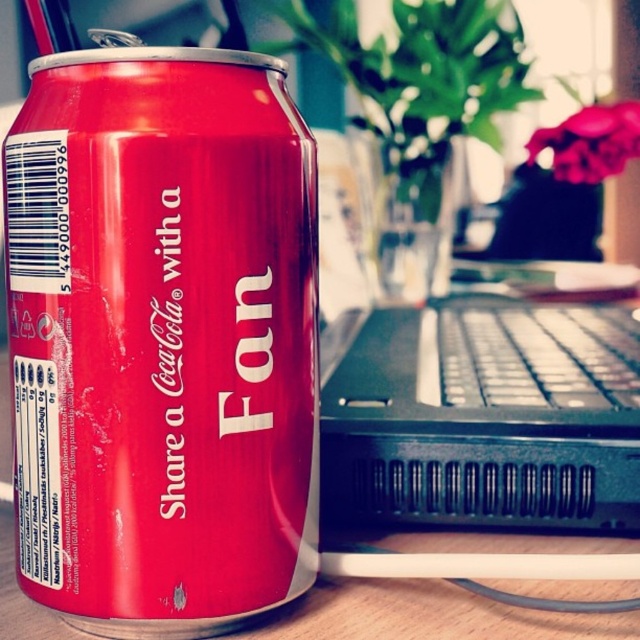
Looking at this image, measure the distance between matte red can at center and black plastic keyboard at center.

A distance of 14.00 inches exists between matte red can at center and black plastic keyboard at center.

Is matte red can at center positioned in front of black plastic keyboard at center?

Yes, matte red can at center is in front of black plastic keyboard at center.

The image size is (640, 640). I want to click on matte red can at center, so click(161, 337).

Locate an element on the screen. The width and height of the screenshot is (640, 640). matte red can at center is located at coordinates (161, 337).